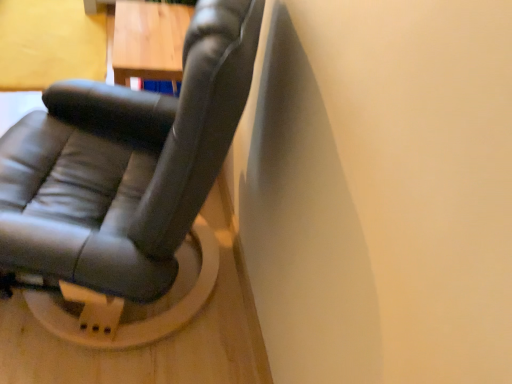
The width and height of the screenshot is (512, 384). What do you see at coordinates (149, 40) in the screenshot?
I see `wooden table at upper left` at bounding box center [149, 40].

This screenshot has height=384, width=512. Find the location of `wooden table at upper left`. wooden table at upper left is located at coordinates (149, 40).

What is the approximate height of wooden table at upper left?

wooden table at upper left is 17.51 inches tall.

Image resolution: width=512 pixels, height=384 pixels. I want to click on matte black chair at center, so point(126,187).

The width and height of the screenshot is (512, 384). What do you see at coordinates (126, 187) in the screenshot?
I see `matte black chair at center` at bounding box center [126, 187].

At what (x,y) coordinates should I click in order to perform the action: click on wooden table at upper left. Please return your answer as a coordinate pair (x, y). The width and height of the screenshot is (512, 384). Looking at the image, I should click on (149, 40).

Considering the relative positions of wooden table at upper left and matte black chair at center in the image provided, is wooden table at upper left to the left or to the right of matte black chair at center?

wooden table at upper left is positioned on matte black chair at center's right side.

Between wooden table at upper left and matte black chair at center, which one is positioned behind?

wooden table at upper left.

Does point (124, 73) come farther from viewer compared to point (192, 54)?

Yes.

Looking at this image, from the image's perspective, is wooden table at upper left under matte black chair at center?

No.

From a real-world perspective, who is located higher, wooden table at upper left or matte black chair at center?

wooden table at upper left.

Is wooden table at upper left thinner than matte black chair at center?

Yes.

In terms of height, does wooden table at upper left look taller or shorter compared to matte black chair at center?

In the image, wooden table at upper left appears to be taller than matte black chair at center.

Looking at the image, does wooden table at upper left seem bigger or smaller compared to matte black chair at center?

wooden table at upper left is smaller than matte black chair at center.

Which is correct: wooden table at upper left is inside matte black chair at center, or outside of it?

The correct answer is: outside.

Is wooden table at upper left not close to matte black chair at center?

No.

Could you tell me if wooden table at upper left is facing matte black chair at center?

No, wooden table at upper left is not facing towards matte black chair at center.

How distant is wooden table at upper left from matte black chair at center?

A distance of 20.90 inches exists between wooden table at upper left and matte black chair at center.

This screenshot has height=384, width=512. I want to click on chair on the left of the wooden table at upper left, so click(x=126, y=187).

Considering the relative positions of matte black chair at center and wooden table at upper left in the image provided, is matte black chair at center to the left or to the right of wooden table at upper left?

In the image, matte black chair at center appears on the left side of wooden table at upper left.

Is the depth of matte black chair at center greater than that of wooden table at upper left?

No, it is in front of wooden table at upper left.

Which point is more distant from viewer, (102, 181) or (168, 66)?

Positioned behind is point (168, 66).

From the image's perspective, would you say matte black chair at center is positioned over wooden table at upper left?

No, from the image's perspective, matte black chair at center is not on top of wooden table at upper left.

From a real-world perspective, between matte black chair at center and wooden table at upper left, who is vertically higher?

From a 3D spatial view, wooden table at upper left is above.

Is matte black chair at center thinner than wooden table at upper left?

No, matte black chair at center is not thinner than wooden table at upper left.

Who is shorter, matte black chair at center or wooden table at upper left?

Standing shorter between the two is matte black chair at center.

Is matte black chair at center bigger or smaller than wooden table at upper left?

Clearly, matte black chair at center is larger in size than wooden table at upper left.

Is wooden table at upper left inside matte black chair at center?

No, matte black chair at center does not contain wooden table at upper left.

Is matte black chair at center positioned far away from wooden table at upper left?

No, matte black chair at center is not far away from wooden table at upper left.

Is matte black chair at center facing away from wooden table at upper left?

No, matte black chair at center is not facing away from wooden table at upper left.

How many degrees apart are the facing directions of matte black chair at center and wooden table at upper left?

The angular difference between matte black chair at center and wooden table at upper left is 90 degrees.

Where is `chair located in front of the wooden table at upper left`? chair located in front of the wooden table at upper left is located at coordinates (126, 187).

Identify the location of table on the right of matte black chair at center. (149, 40).

Locate an element on the screen. This screenshot has height=384, width=512. table that is above the matte black chair at center (from a real-world perspective) is located at coordinates (149, 40).